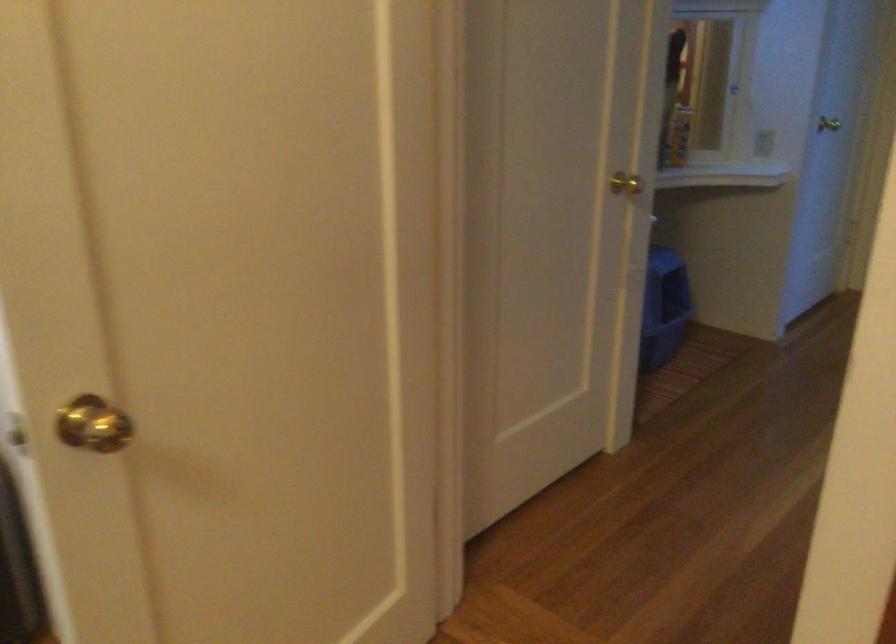
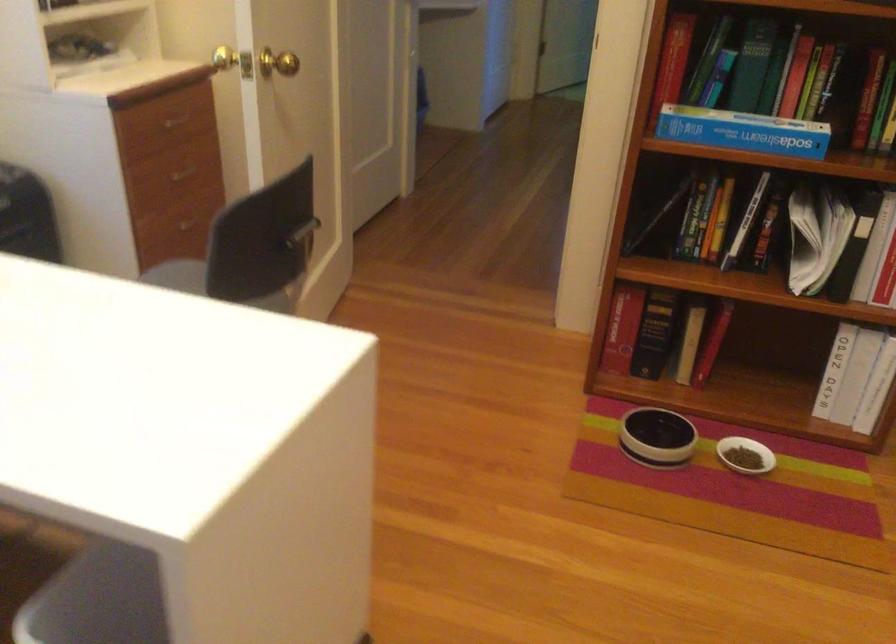
Question: I am providing you with two images of the same scene from different viewpoints. Please identify which objects are invisible in image2.

Choices:
 (A) small green carton
 (B) blue litter box
 (C) drawer knob
 (D) black book

Answer: (B)